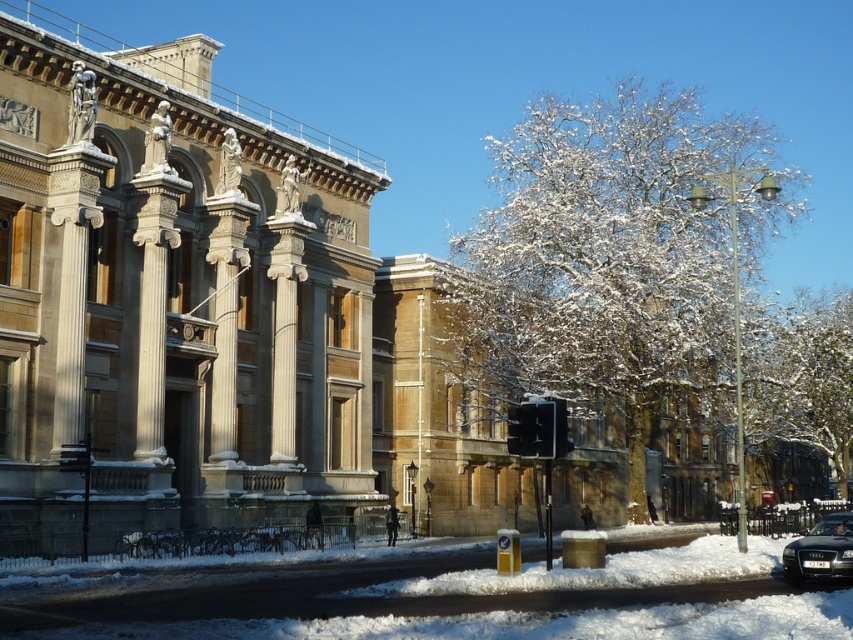
Question: Does snow-covered tree at center lie behind white snow-covered tree at upper right?

Choices:
 (A) yes
 (B) no

Answer: (B)

Question: Which object is closer to the camera taking this photo?

Choices:
 (A) snow-covered tree at center
 (B) shiny black car at lower right
 (C) white snow-covered tree at upper right

Answer: (B)

Question: Which point is closer to the camera?

Choices:
 (A) snow-covered tree at center
 (B) shiny black car at lower right

Answer: (B)

Question: Which is nearer to the white snow-covered tree at upper right?

Choices:
 (A) snow-covered tree at center
 (B) shiny black car at lower right

Answer: (A)

Question: Is snow-covered tree at center above white snow-covered tree at upper right?

Choices:
 (A) no
 (B) yes

Answer: (B)

Question: Is white snow-covered tree at upper right to the right of shiny black car at lower right from the viewer's perspective?

Choices:
 (A) yes
 (B) no

Answer: (A)